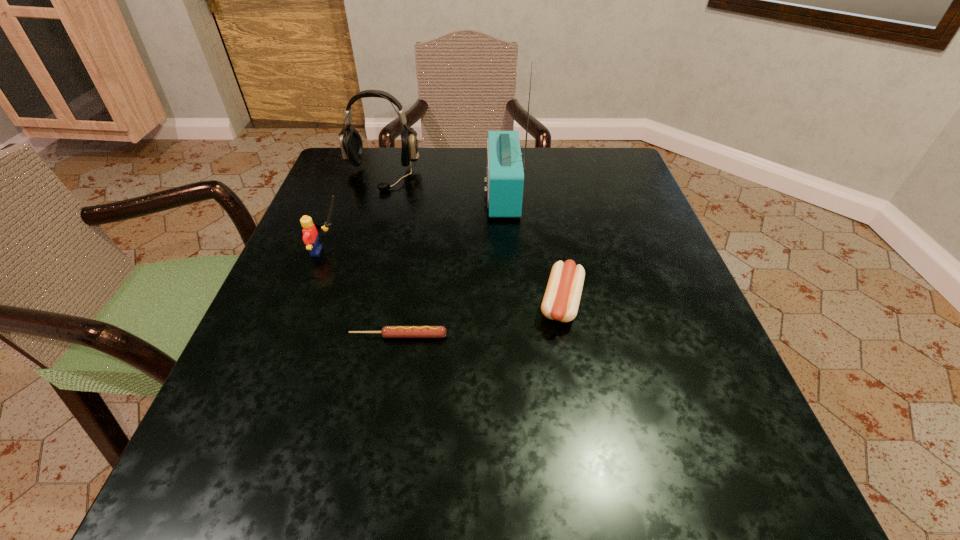
Find the location of `free spot that satisfies the following two spatial constraints: 1. on the front-facing side of the third nearest object; 2. on the back side of the rightmost object`. free spot that satisfies the following two spatial constraints: 1. on the front-facing side of the third nearest object; 2. on the back side of the rightmost object is located at coordinates click(308, 303).

The height and width of the screenshot is (540, 960). What are the coordinates of `vacant region that satisfies the following two spatial constraints: 1. with the microphone on the side of the headset; 2. on the front-facing side of the third shortest object` in the screenshot? It's located at (358, 251).

Image resolution: width=960 pixels, height=540 pixels. I want to click on vacant area that satisfies the following two spatial constraints: 1. on the front panel of the fourth object from left to right; 2. on the right side of the second shortest object, so click(x=510, y=303).

The width and height of the screenshot is (960, 540). I want to click on vacant space that satisfies the following two spatial constraints: 1. on the front-facing side of the left sausage; 2. on the right side of the Lego, so click(x=296, y=336).

Find the location of a particular element. The height and width of the screenshot is (540, 960). vacant position in the image that satisfies the following two spatial constraints: 1. on the front-facing side of the third tallest object; 2. on the back side of the shortest object is located at coordinates (296, 336).

Where is `vacant point that satisfies the following two spatial constraints: 1. with the microphone on the side of the second tallest object; 2. on the left side of the taller sausage`? The width and height of the screenshot is (960, 540). vacant point that satisfies the following two spatial constraints: 1. with the microphone on the side of the second tallest object; 2. on the left side of the taller sausage is located at coordinates (343, 303).

At what (x,y) coordinates should I click in order to perform the action: click on free point that satisfies the following two spatial constraints: 1. with the microphone on the side of the headset; 2. on the right side of the taller sausage. Please return your answer as a coordinate pair (x, y). The height and width of the screenshot is (540, 960). Looking at the image, I should click on (343, 303).

Locate an element on the screen. free location that satisfies the following two spatial constraints: 1. with the microphone on the side of the second shortest object; 2. on the right side of the headset is located at coordinates click(343, 303).